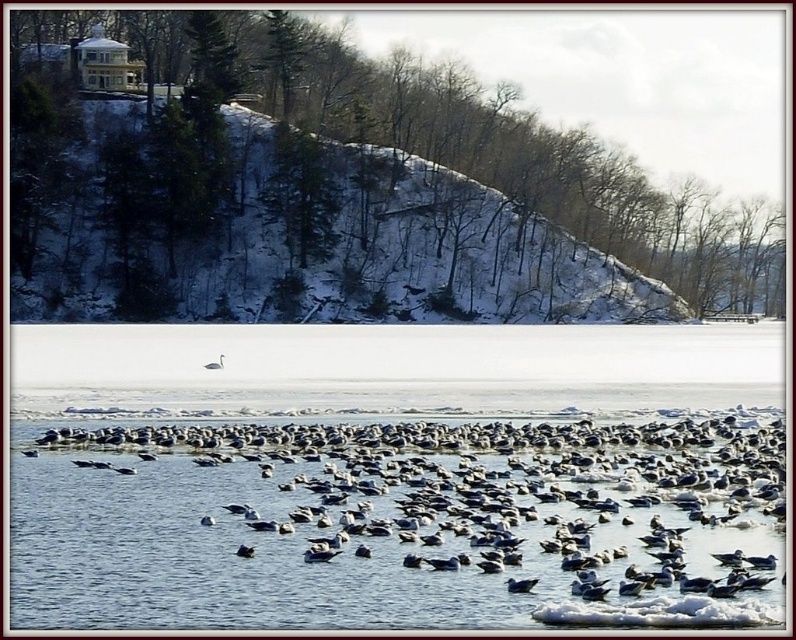
You are a birdwatcher observing the winter scene. You notice a white matte bird at center. Based on its coordinates, is it closer to the foreground or the background of the image?

The white matte bird at center is located at point 0.914 on the x and 0.655 on the y axis. Since the coordinates are closer to the center of the image, it is positioned in the middle ground, not the foreground or background.